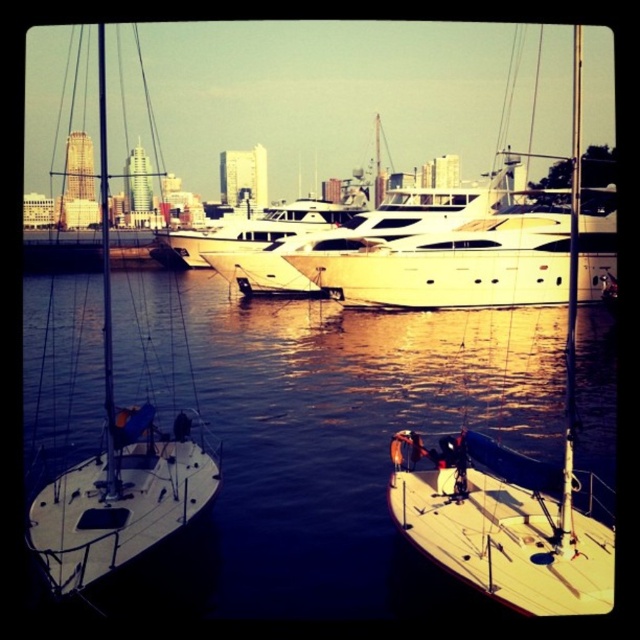
You are a harbor security guard observing the white matte sailboat at left and the white matte sailboat at lower right. Based on their positions, which one is closer to the water surface?

The white matte sailboat at left is located below the white matte sailboat at lower right, so it is closer to the water surface.

In the scene shown: You are a photographer planning to capture the harbor scene. You want to ensure that the white glossy water at center and the white glossy yacht at center are both visible in your shot. Based on their widths, which one should you position closer to the center of your frame to avoid cropping either?

The white glossy water at center is wider than the white glossy yacht at center. To avoid cropping either, position the white glossy water at center closer to the center of your frame since its greater width allows it to occupy more space without needing to be centered precisely.

You are a photographer standing at the edge of the harbor, and you want to capture a photo of both the white glossy water at center and the white glossy yacht at center. Based on their heights, which object should you focus on first to ensure both are in the frame?

The white glossy water at center is shorter than the white glossy yacht at center, so you should focus on the white glossy yacht at center first to ensure both are in the frame.